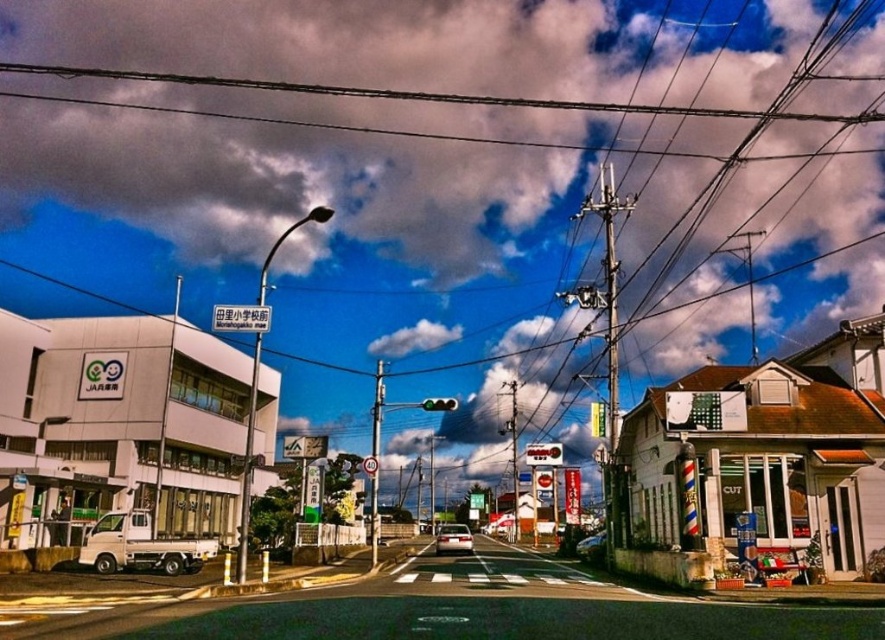
Consider the image. You are a pedestrian standing at the edge of the road and want to cross to the other side. You see a silver metallic car at center and a green glass traffic light at center. Which object is closer to you?

The silver metallic car at center is closer to you because it is further to the viewer than the green glass traffic light at center.

In the scene shown: You are a delivery person trying to navigate through the street. You see a metallic wire at upper center and a silver metallic car at center. Which object is positioned to the left side from your perspective?

The metallic wire at upper center is positioned to the left of the silver metallic car at center.